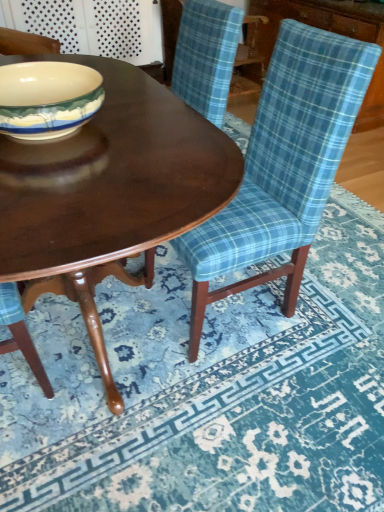
Question: From a real-world perspective, is matte ceramic bowl at center-left on blue plaid fabric chair at center?

Choices:
 (A) no
 (B) yes

Answer: (B)

Question: Would you consider matte ceramic bowl at center-left to be distant from blue plaid fabric chair at center?

Choices:
 (A) yes
 (B) no

Answer: (B)

Question: Is matte ceramic bowl at center-left facing towards blue plaid fabric chair at center?

Choices:
 (A) no
 (B) yes

Answer: (A)

Question: Is matte ceramic bowl at center-left bigger than blue plaid fabric chair at center?

Choices:
 (A) yes
 (B) no

Answer: (B)

Question: From the image's perspective, is matte ceramic bowl at center-left under blue plaid fabric chair at center?

Choices:
 (A) yes
 (B) no

Answer: (B)

Question: Can you confirm if matte ceramic bowl at center-left is smaller than blue plaid fabric chair at center?

Choices:
 (A) no
 (B) yes

Answer: (B)

Question: Considering the relative sizes of blue plaid fabric at lower right and blue plaid fabric chair at center in the image provided, is blue plaid fabric at lower right smaller than blue plaid fabric chair at center?

Choices:
 (A) yes
 (B) no

Answer: (A)

Question: Considering the relative sizes of blue plaid fabric at lower right and blue plaid fabric chair at center in the image provided, is blue plaid fabric at lower right shorter than blue plaid fabric chair at center?

Choices:
 (A) yes
 (B) no

Answer: (A)

Question: Is blue plaid fabric chair at center inside blue plaid fabric at lower right?

Choices:
 (A) yes
 (B) no

Answer: (B)

Question: Can you confirm if blue plaid fabric at lower right is positioned to the right of blue plaid fabric chair at center?

Choices:
 (A) yes
 (B) no

Answer: (A)

Question: Does blue plaid fabric at lower right turn towards blue plaid fabric chair at center?

Choices:
 (A) no
 (B) yes

Answer: (A)

Question: Is blue plaid fabric at lower right thinner than blue plaid fabric chair at center?

Choices:
 (A) yes
 (B) no

Answer: (B)

Question: From the image's perspective, is blue plaid fabric at lower right located above shiny dark wood coffee table at center?

Choices:
 (A) no
 (B) yes

Answer: (A)